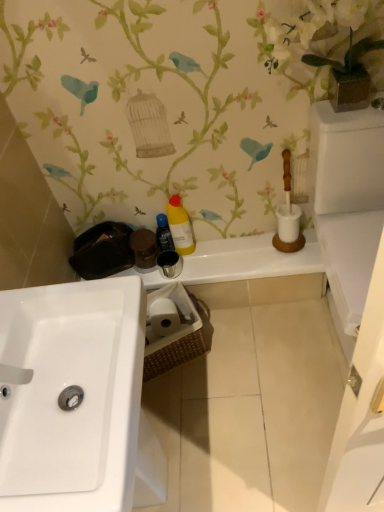
You are a GUI agent. You are given a task and a screenshot of the screen. Output one action in this format:
    pyautogui.click(x=<x>, y=<y>)
    Task: Click on the free point in front of yellow matte bottle at center, which is the 2th cleaning product in left-to-right order
    The width and height of the screenshot is (384, 512).
    Given the screenshot: What is the action you would take?
    pyautogui.click(x=206, y=266)